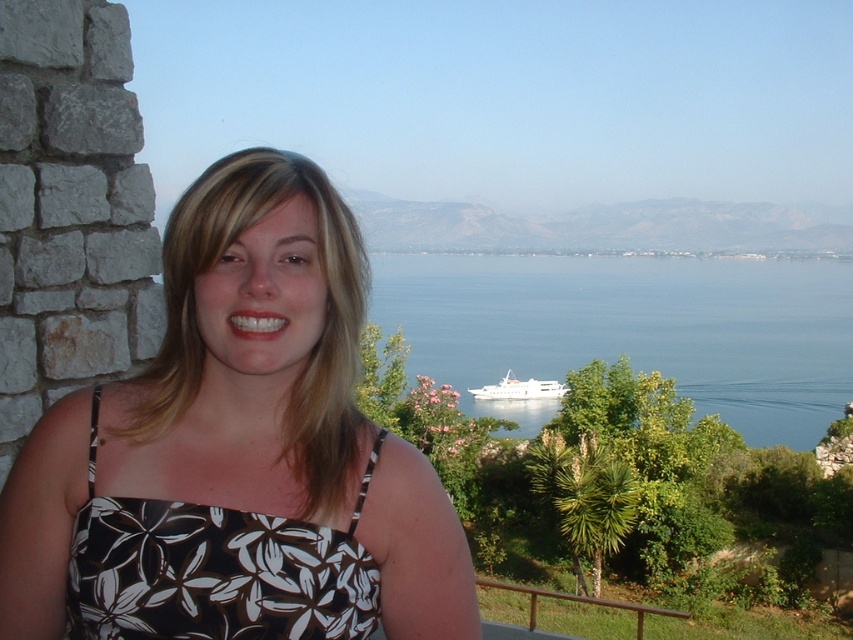
You are standing at the same position as the woman in the image and want to determine which of the two points, point [74,468] or point [526,396], is physically closer to you. Based on the scene description, which point is nearer?

Point [74,468] is closer to the viewer than point [526,396].

Based on the photo, you are standing at the position of the woman in the scene. Looking towards the point marked at coordinates (633, 330), which object in the scene does this point lie on?

The point marked at coordinates (633, 330) lies on the blue water at center.